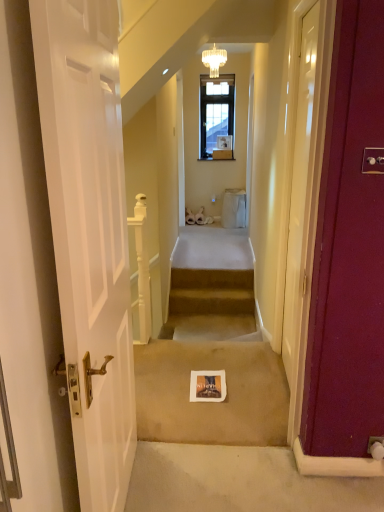
Question: Is the depth of gold textured chandelier at upper center less than that of white glossy door at right, the second door when ordered from left to right?

Choices:
 (A) no
 (B) yes

Answer: (A)

Question: From the image's perspective, is gold textured chandelier at upper center located above white glossy door at right, which is counted as the 1th door, starting from the back?

Choices:
 (A) no
 (B) yes

Answer: (B)

Question: Does gold textured chandelier at upper center appear on the right side of white glossy door at right, which is counted as the 1th door, starting from the back?

Choices:
 (A) no
 (B) yes

Answer: (A)

Question: From the image's perspective, is gold textured chandelier at upper center located beneath white glossy door at right, the first door from the right?

Choices:
 (A) yes
 (B) no

Answer: (B)

Question: Does gold textured chandelier at upper center have a smaller size compared to white glossy door at right, which is counted as the 1th door, starting from the back?

Choices:
 (A) no
 (B) yes

Answer: (B)

Question: From a real-world perspective, is gold textured chandelier at upper center positioned under white glossy door at right, the first door from the right, based on gravity?

Choices:
 (A) yes
 (B) no

Answer: (B)

Question: Could you tell me if beige carpeted stairs at center is facing beige carpet at center?

Choices:
 (A) yes
 (B) no

Answer: (A)

Question: Is beige carpeted stairs at center facing away from beige carpet at center?

Choices:
 (A) yes
 (B) no

Answer: (B)

Question: Is beige carpeted stairs at center closer to the viewer compared to beige carpet at center?

Choices:
 (A) yes
 (B) no

Answer: (B)

Question: Considering the relative positions of beige carpeted stairs at center and beige carpet at center in the image provided, is beige carpeted stairs at center to the left of beige carpet at center from the viewer's perspective?

Choices:
 (A) yes
 (B) no

Answer: (B)

Question: From the image's perspective, is beige carpeted stairs at center above beige carpet at center?

Choices:
 (A) no
 (B) yes

Answer: (B)

Question: From the image's perspective, is beige carpeted stairs at center below beige carpet at center?

Choices:
 (A) no
 (B) yes

Answer: (A)

Question: Considering the relative positions of beige carpet at center and white wooden door at left, which ranks as the first door in front-to-back order, in the image provided, is beige carpet at center to the left of white wooden door at left, which ranks as the first door in front-to-back order, from the viewer's perspective?

Choices:
 (A) yes
 (B) no

Answer: (B)